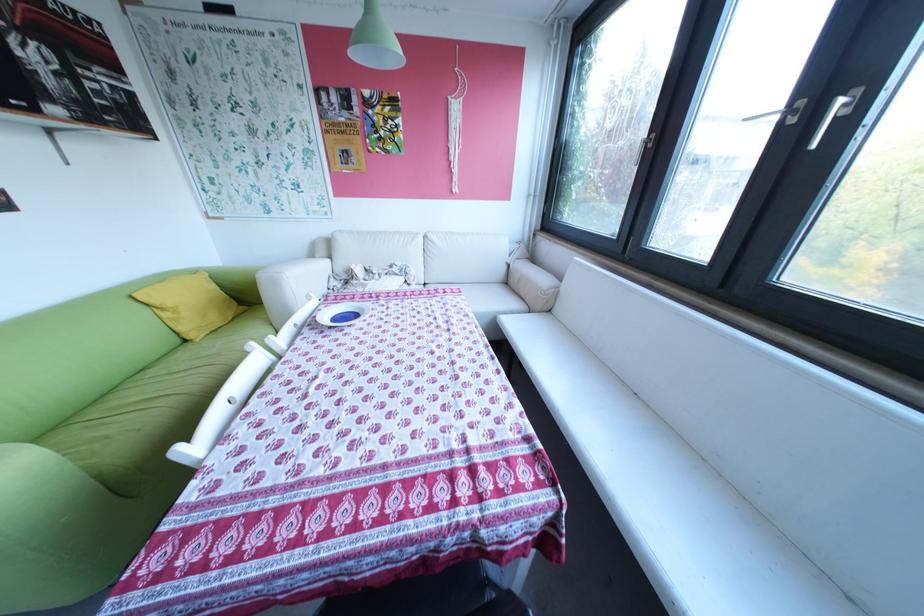
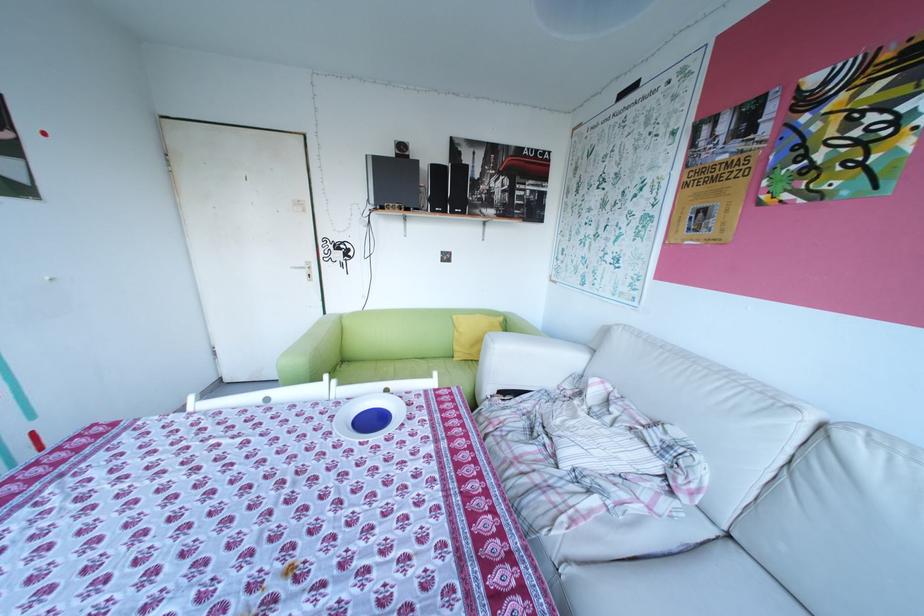
The point at (336, 265) is marked in the first image. Where is the corresponding point in the second image?

(589, 359)